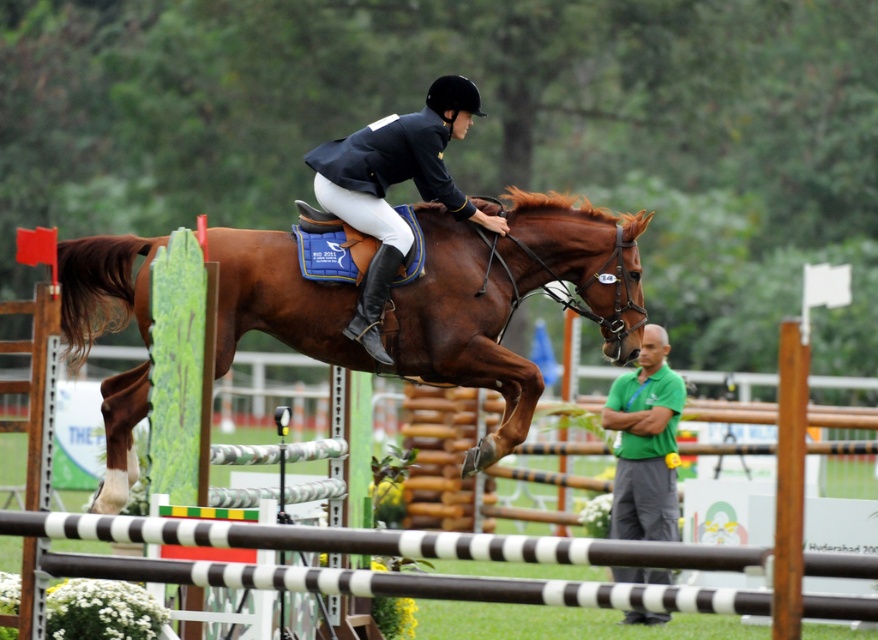
Question: Estimate the real-world distances between objects in this image. Which object is farther from the shiny navy blue jacket at center?

Choices:
 (A) brown glossy horse at center
 (B) green fabric shirt at lower right

Answer: (B)

Question: Considering the relative positions of brown glossy horse at center and green fabric shirt at lower right in the image provided, where is brown glossy horse at center located with respect to green fabric shirt at lower right?

Choices:
 (A) above
 (B) below

Answer: (A)

Question: Does brown glossy horse at center appear over green fabric shirt at lower right?

Choices:
 (A) no
 (B) yes

Answer: (B)

Question: Among these objects, which one is nearest to the camera?

Choices:
 (A) brown glossy horse at center
 (B) green fabric shirt at lower right
 (C) shiny navy blue jacket at center

Answer: (A)

Question: Can you confirm if shiny navy blue jacket at center is positioned to the left of green fabric shirt at lower right?

Choices:
 (A) no
 (B) yes

Answer: (B)

Question: Which of the following is the closest to the observer?

Choices:
 (A) (425, 145)
 (B) (634, 452)

Answer: (A)